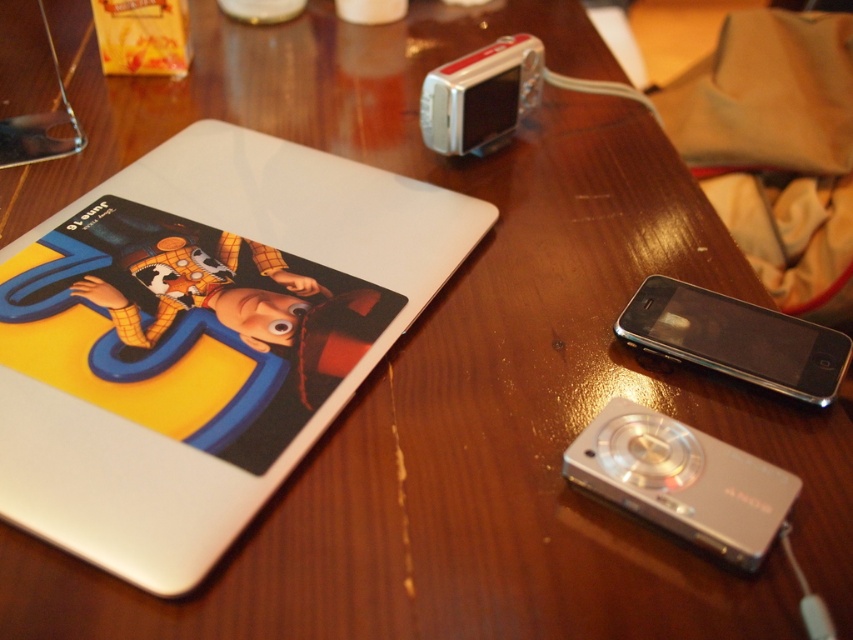
Is silver metallic camera at center further to camera compared to silver metallic camera at upper center?

That is False.

Between silver metallic camera at center and silver metallic camera at upper center, which one has less height?

Standing shorter between the two is silver metallic camera at center.

I want to click on silver metallic camera at center, so click(x=682, y=481).

Which is behind, point (15, 493) or point (447, 131)?

Point (447, 131)

Which is more to the left, glossy white laptop at upper left or silver metallic camera at upper center?

glossy white laptop at upper left is more to the left.

In order to click on glossy white laptop at upper left in this screenshot , I will do `click(201, 339)`.

Where is `glossy white laptop at upper left`? Image resolution: width=853 pixels, height=640 pixels. glossy white laptop at upper left is located at coordinates (201, 339).

Does point (703, 326) lie behind point (529, 61)?

No, (703, 326) is closer to viewer.

Which of these two, black glossy smartphone at right or silver metallic camera at upper center, stands taller?

silver metallic camera at upper center is taller.

Is point (685, 342) less distant than point (463, 129)?

That is True.

Locate an element on the screen. Image resolution: width=853 pixels, height=640 pixels. black glossy smartphone at right is located at coordinates (735, 339).